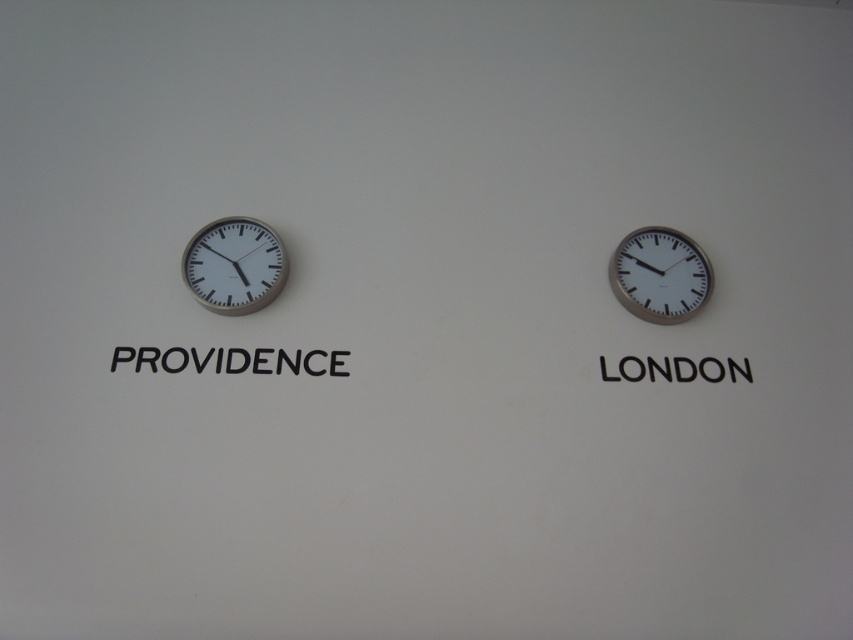
You are an interior designer planning to hang two items on a wall. You have a silver metallic clock at left and a black matte providence at left. Which item will occupy more space horizontally?

The black matte providence at left has a greater width than the silver metallic clock at left, so it will occupy more horizontal space.

You are standing in front of two clocks on a wall. You see the white metallic clock at right and the black matte providence at left. Which clock is positioned higher on the wall?

The white metallic clock at right is located above the black matte providence at left, so it is positioned higher on the wall.